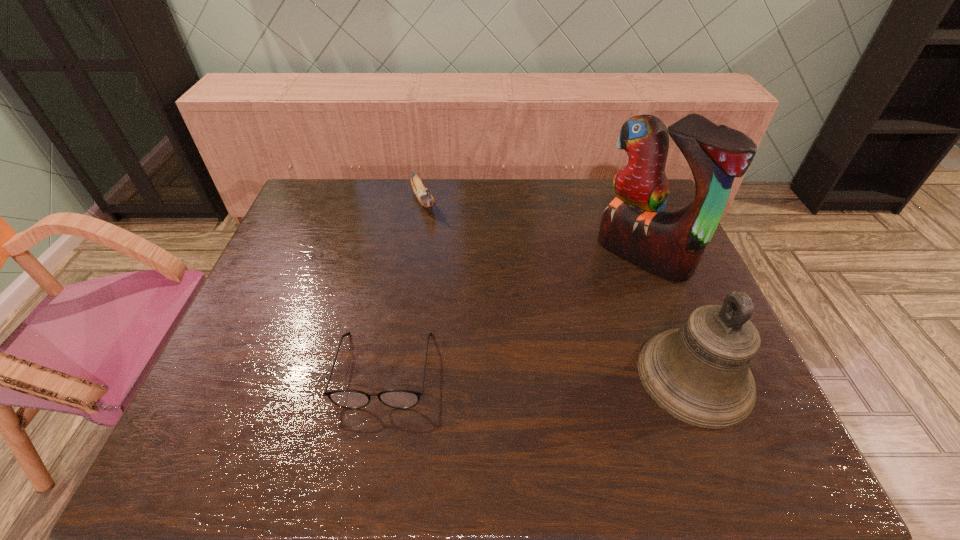
You are a GUI agent. You are given a task and a screenshot of the screen. Output one action in this format:
    pyautogui.click(x=<x>, y=<y>)
    Task: Click on the vacant space at the near edge
    This screenshot has height=540, width=960.
    Given the screenshot: What is the action you would take?
    pyautogui.click(x=289, y=382)

The width and height of the screenshot is (960, 540). In the image, there is a desktop. Identify the location of free region at the left edge. (278, 333).

Where is `vacant area at the right edge of the desktop`? Image resolution: width=960 pixels, height=540 pixels. vacant area at the right edge of the desktop is located at coordinates (666, 294).

Find the location of a particular element. vacant region at the far left corner of the desktop is located at coordinates (320, 198).

The image size is (960, 540). Find the location of `vacant region between the third nearest object and the spectacles`. vacant region between the third nearest object and the spectacles is located at coordinates (514, 312).

At what (x,y) coordinates should I click in order to perform the action: click on vacant area that lies between the second tallest object and the farthest object. Please return your answer as a coordinate pair (x, y). Looking at the image, I should click on (559, 288).

Where is `vacant area between the bell and the spectacles`? vacant area between the bell and the spectacles is located at coordinates (540, 373).

Where is `empty space that is in between the bell and the third tallest object`? This screenshot has height=540, width=960. empty space that is in between the bell and the third tallest object is located at coordinates point(559,288).

Locate an element on the screen. This screenshot has height=540, width=960. vacant space that is in between the banana and the second tallest object is located at coordinates pos(559,288).

Identify the location of empty space that is in between the second shortest object and the tallest object. The height and width of the screenshot is (540, 960). (533, 228).